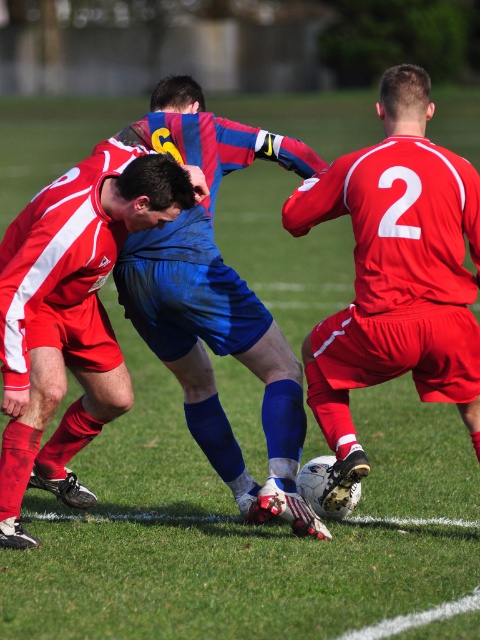
The width and height of the screenshot is (480, 640). What are the coordinates of `matte red jersey at center` in the screenshot? It's located at (395, 275).

Is matte red jersey at center shorter than blue fabric shorts at center?

Yes.

Does point (328, 396) come closer to viewer compared to point (283, 138)?

Yes, point (328, 396) is in front of point (283, 138).

Identify the location of matte red jersey at center. The height and width of the screenshot is (640, 480). (395, 275).

Can you confirm if blue fabric shirt at center is positioned to the left of blue fabric shorts at center?

Indeed, blue fabric shirt at center is positioned on the left side of blue fabric shorts at center.

Can you confirm if blue fabric shirt at center is positioned below blue fabric shorts at center?

Correct, blue fabric shirt at center is located below blue fabric shorts at center.

Which is in front, point (8, 524) or point (222, 419)?

Point (8, 524)

You are a GUI agent. You are given a task and a screenshot of the screen. Output one action in this format:
    pyautogui.click(x=<x>, y=<y>)
    Task: Click on the blue fabric shirt at center
    The width and height of the screenshot is (480, 640).
    Given the screenshot: What is the action you would take?
    pyautogui.click(x=71, y=308)

Can you confirm if matte red jersey at center is taller than blue fabric shirt at center?

Indeed, matte red jersey at center has a greater height compared to blue fabric shirt at center.

Who is more forward, [346,308] or [32,276]?

Point [32,276] is in front.

Is point (352, 330) positioned before point (75, 484)?

Yes, point (352, 330) is in front of point (75, 484).

This screenshot has height=640, width=480. Identify the location of matte red jersey at center. (395, 275).